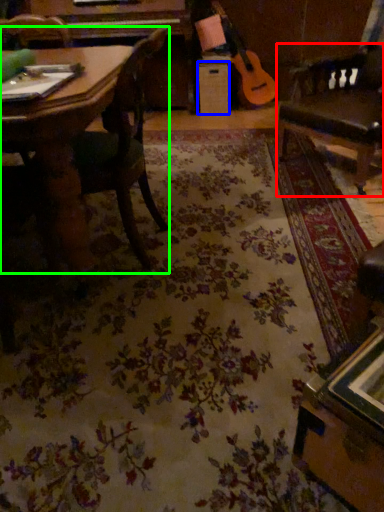
Question: Based on their relative distances, which object is nearer to swivel chair (highlighted by a red box)? Choose from drawer (highlighted by a blue box) and chair (highlighted by a green box).

Choices:
 (A) drawer
 (B) chair

Answer: (B)